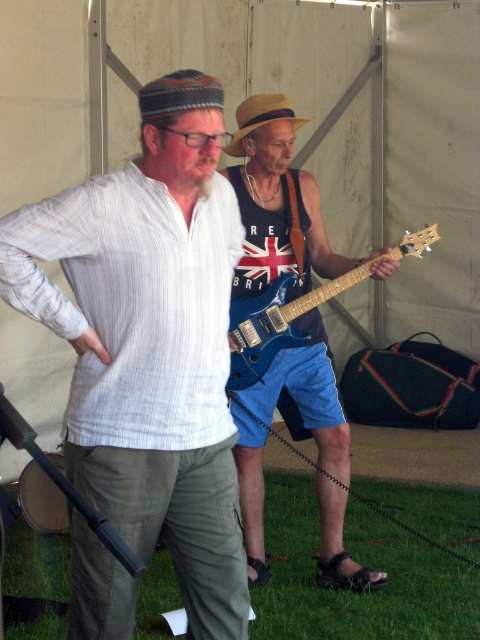
Question: Can you confirm if matte white shirt at center is positioned below glossy electric guitar at center?

Choices:
 (A) no
 (B) yes

Answer: (B)

Question: Which point is closer to the camera?

Choices:
 (A) brown straw cowboy hat at center
 (B) blue glossy electric guitar at center
 (C) glossy electric guitar at center
 (D) matte white shirt at center

Answer: (D)

Question: Among these points, which one is farthest from the camera?

Choices:
 (A) (294, 284)
 (B) (389, 264)
 (C) (189, 586)
 (D) (239, 113)

Answer: (D)

Question: In this image, where is matte white shirt at center located relative to blue glossy electric guitar at center?

Choices:
 (A) left
 (B) right

Answer: (A)

Question: Can you confirm if matte white shirt at center is positioned to the right of brown straw cowboy hat at center?

Choices:
 (A) yes
 (B) no

Answer: (B)

Question: Which object is closer to the camera taking this photo?

Choices:
 (A) matte white shirt at center
 (B) blue glossy electric guitar at center
 (C) brown straw cowboy hat at center

Answer: (A)